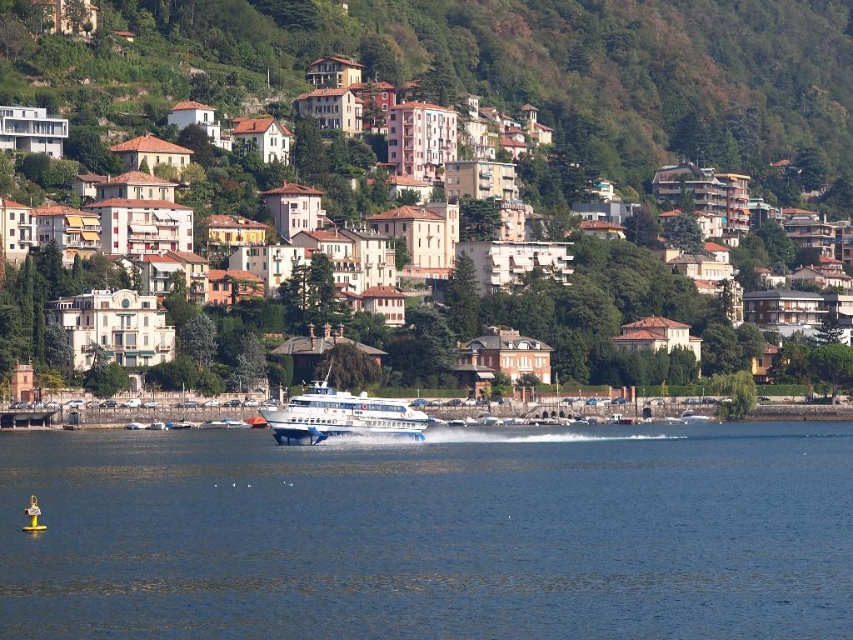
Based on the photo, between blue water at center and white glossy cruise ship at center, which one has less height?

blue water at center

Between blue water at center and white glossy cruise ship at center, which one is positioned higher?

Positioned higher is white glossy cruise ship at center.

Who is more distant from viewer, (x=689, y=512) or (x=335, y=432)?

The point (x=335, y=432) is behind.

Find the location of a particular element. blue water at center is located at coordinates (432, 536).

Who is positioned more to the left, white matte buildings at center or white glossy cruise ship at center?

white glossy cruise ship at center

Can you confirm if white matte buildings at center is positioned to the right of white glossy cruise ship at center?

Indeed, white matte buildings at center is positioned on the right side of white glossy cruise ship at center.

Measure the distance between point (706,362) and camera.

Point (706,362) is 339.59 meters away from camera.

The image size is (853, 640). What are the coordinates of `white matte buildings at center` in the screenshot? It's located at coord(604,300).

Is blue water at center below white matte buildings at center?

Yes.

Does point (231, 461) come in front of point (572, 168)?

That is True.

Does point (403, 474) lie behind point (625, 257)?

No, it is not.

This screenshot has height=640, width=853. I want to click on blue water at center, so click(432, 536).